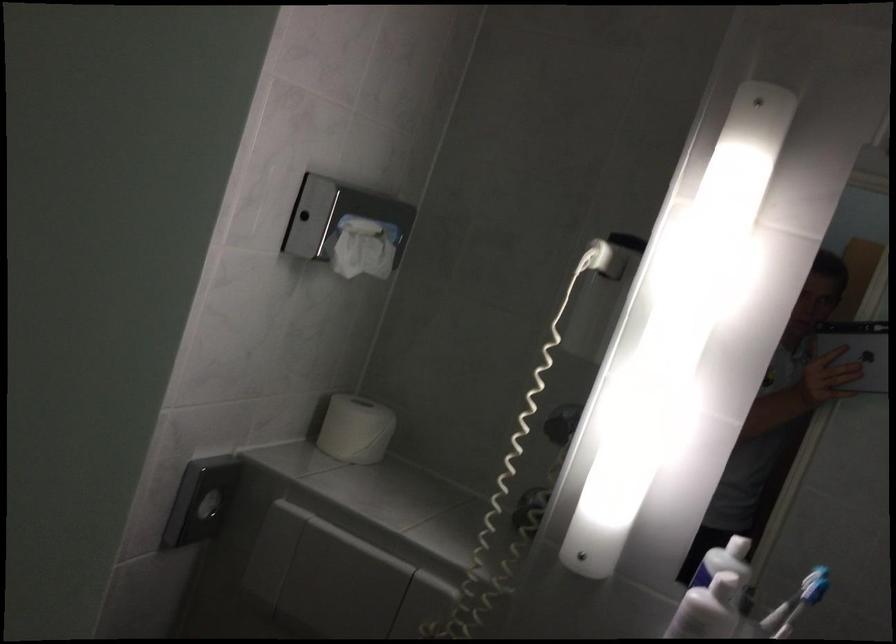
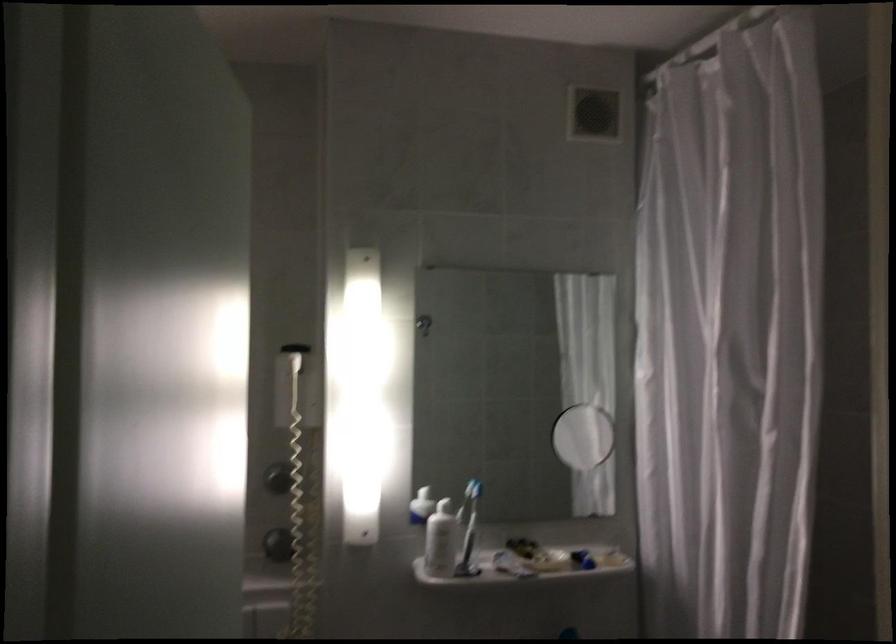
Find the pixel in the second image that matches (x=556, y=428) in the first image.

(278, 478)